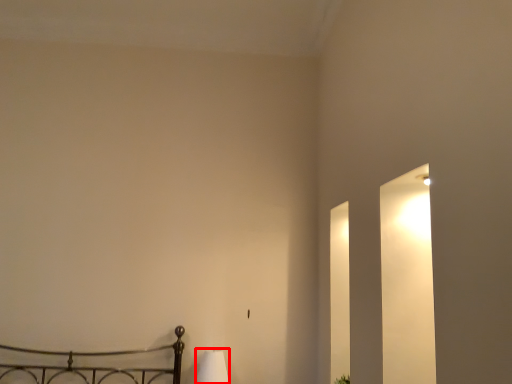
Question: From the image's perspective, what is the correct spatial relationship of lamp (annotated by the red box) in relation to plant?

Choices:
 (A) above
 (B) below

Answer: (A)